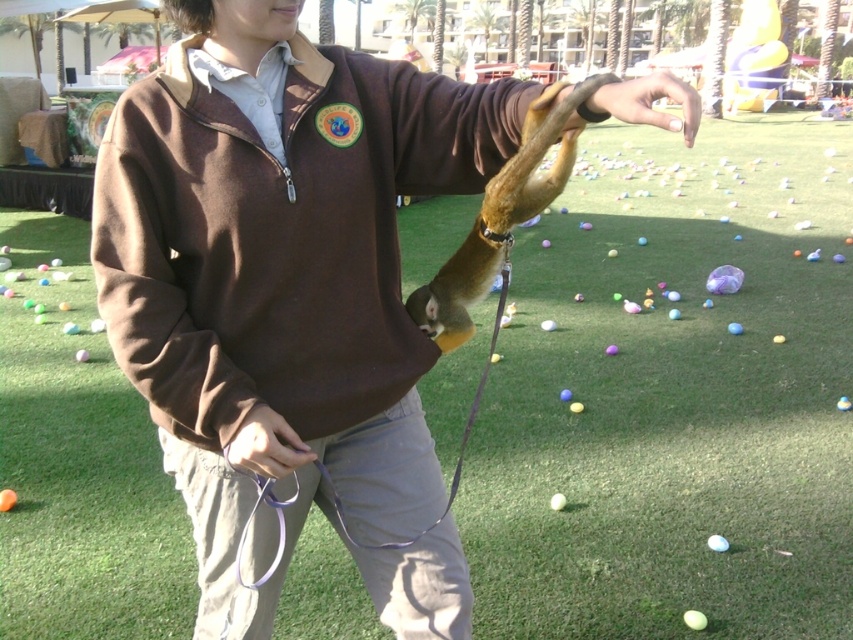
From the picture: You are a photographer at the event and want to capture a clear shot of both the brown fleece sweater at center and the nail polish at center. Since the nail polish is small, you need to ensure it is in focus. Which object should you zoom in on first to ensure both are in focus?

The brown fleece sweater at center has a greater height compared to nail polish at center, so you should zoom in on the nail polish at center first to ensure it is in focus before adjusting for the larger sweater.

From the picture: You are a photographer trying to capture the monkey reaching towards the camera. To ensure the focus is on the monkey, you need to avoid the brown fleece sweater at center. Where is the point at coordinate (281, 273) located?

The point at coordinate (281, 273) is located on the brown fleece sweater at center, so you should adjust your focus away from that area to capture the monkey clearly.